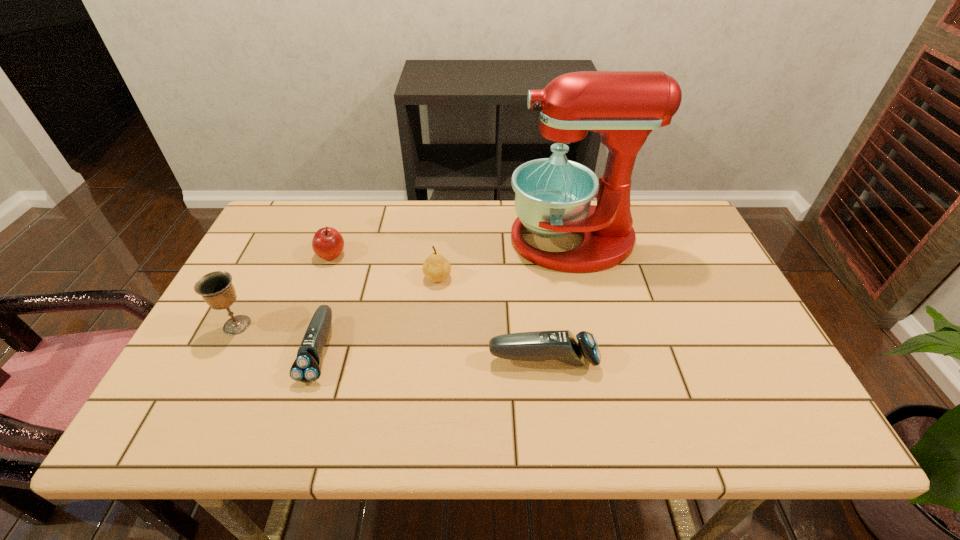
Where is `free space at the left edge`? This screenshot has width=960, height=540. free space at the left edge is located at coordinates (213, 348).

I want to click on vacant space at the right edge, so click(752, 346).

In the image, there is a desktop. Where is `vacant space at the far right corner`? vacant space at the far right corner is located at coordinates (645, 220).

This screenshot has height=540, width=960. I want to click on vacant area that lies between the taller electric shaver and the shorter electric shaver, so click(x=431, y=355).

I want to click on vacant region between the left electric shaver and the apple, so click(x=325, y=302).

Identify the location of vacant region between the pear and the taller electric shaver. (491, 319).

The image size is (960, 540). What are the coordinates of `unoccupied area between the leftmost object and the pear` in the screenshot? It's located at (337, 301).

This screenshot has height=540, width=960. I want to click on free space between the tallest object and the pear, so click(x=505, y=259).

Image resolution: width=960 pixels, height=540 pixels. Identify the location of unoccupied position between the taller electric shaver and the apple. (437, 307).

Identify the location of free space between the leftmost object and the right electric shaver. This screenshot has height=540, width=960. (x=390, y=342).